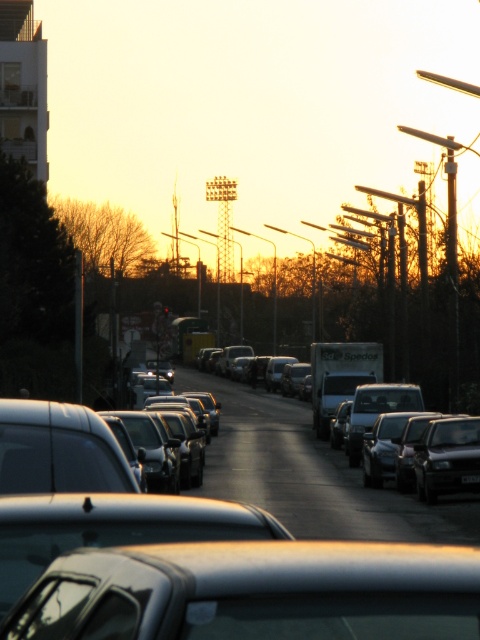
Question: Which of these objects is positioned closest to the black plastic license plate at center?

Choices:
 (A) matte black truck at center
 (B) metallic silver car at center

Answer: (A)

Question: Does metallic silver car at center appear on the left side of matte black truck at center?

Choices:
 (A) no
 (B) yes

Answer: (A)

Question: Which of the following is the closest to the observer?

Choices:
 (A) matte black truck at center
 (B) metallic silver car at center

Answer: (B)

Question: Observing the image, what is the correct spatial positioning of metallic silver car at center in reference to black plastic license plate at center?

Choices:
 (A) left
 (B) right

Answer: (A)

Question: Does metallic silver car at center have a larger size compared to black plastic license plate at center?

Choices:
 (A) yes
 (B) no

Answer: (A)

Question: Among these points, which one is farthest from the camera?

Choices:
 (A) (316, 493)
 (B) (328, 570)
 (C) (478, 480)

Answer: (A)